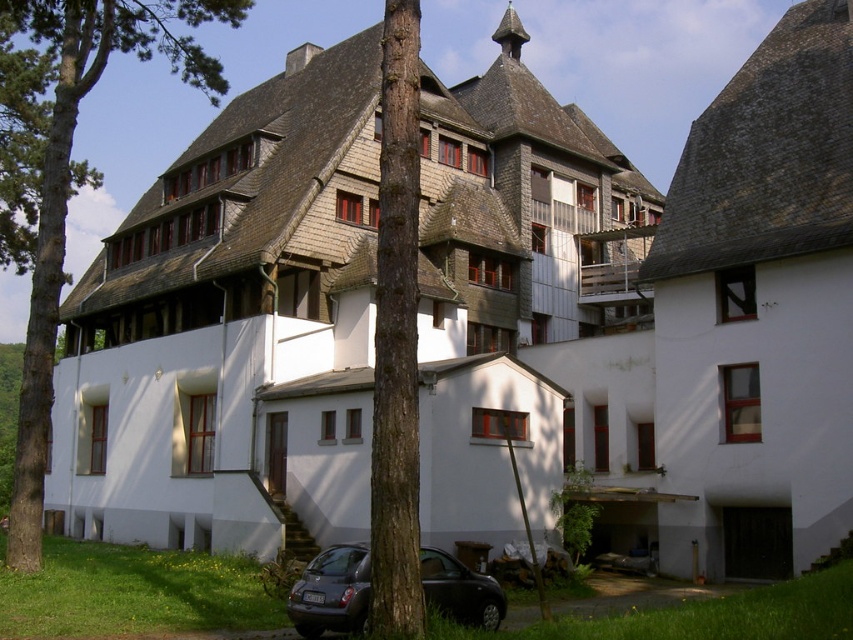
Does green bark tree at left appear on the left side of brown rough bark tree at center?

Yes, green bark tree at left is to the left of brown rough bark tree at center.

Can you confirm if green bark tree at left is taller than brown rough bark tree at center?

Yes, green bark tree at left is taller than brown rough bark tree at center.

Find the location of a particular element. This screenshot has height=640, width=853. green bark tree at left is located at coordinates (82, 182).

Is green bark tree at left positioned in front of metallic gray hatchback at lower center?

No, it is behind metallic gray hatchback at lower center.

Can you confirm if green bark tree at left is smaller than metallic gray hatchback at lower center?

Incorrect, green bark tree at left is not smaller in size than metallic gray hatchback at lower center.

Measure the distance between green bark tree at left and camera.

They are 151.31 feet apart.

Where is `green bark tree at left`? The height and width of the screenshot is (640, 853). green bark tree at left is located at coordinates point(82,182).

Does brown rough bark tree at center have a lesser height compared to metallic gray hatchback at lower center?

Incorrect, brown rough bark tree at center's height does not fall short of metallic gray hatchback at lower center's.

Can you confirm if brown rough bark tree at center is thinner than metallic gray hatchback at lower center?

Indeed, brown rough bark tree at center has a lesser width compared to metallic gray hatchback at lower center.

Describe the element at coordinates (396, 339) in the screenshot. I see `brown rough bark tree at center` at that location.

Where is `brown rough bark tree at center`? brown rough bark tree at center is located at coordinates point(396,339).